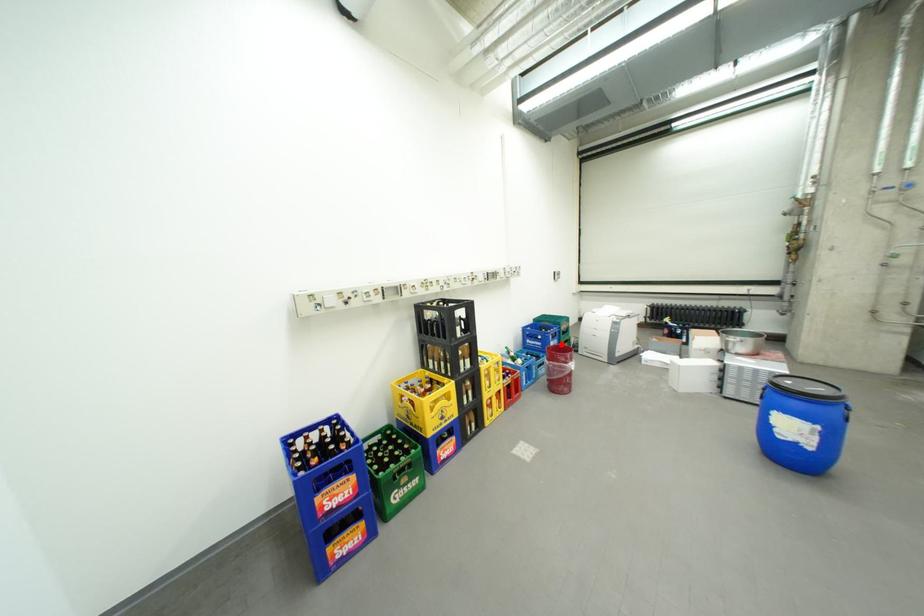
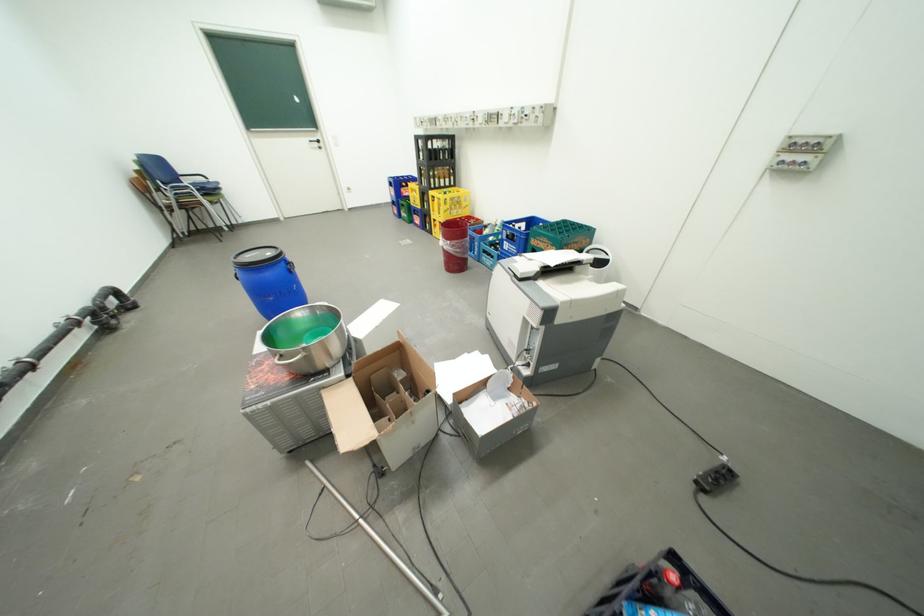
Question: I am providing you with two images of the same scene from different viewpoints. Image1 has a red point marked. In image2, the corresponding 3D location appears at what relative position? Reply with the corresponding letter.

Choices:
 (A) Closer
 (B) Farther

Answer: (B)